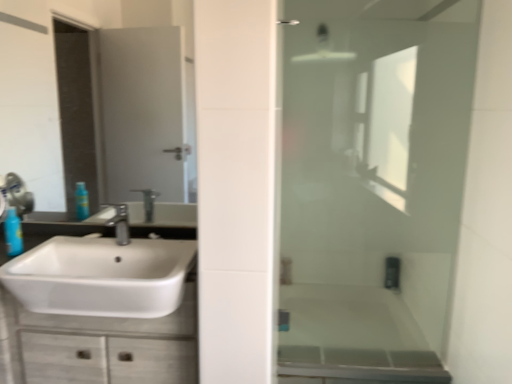
The height and width of the screenshot is (384, 512). Find the location of `satin nickel faucet at center`. satin nickel faucet at center is located at coordinates (120, 223).

The image size is (512, 384). What do you see at coordinates (101, 274) in the screenshot?
I see `white glossy sink at left` at bounding box center [101, 274].

In order to click on clear glass mirror at upper left in this screenshot , I will do `click(56, 80)`.

What is the approximate width of transparent glass shower door at right?

It is 2.01 inches.

Describe the element at coordinates (373, 185) in the screenshot. The height and width of the screenshot is (384, 512). I see `transparent glass shower door at right` at that location.

You are a GUI agent. You are given a task and a screenshot of the screen. Output one action in this format:
    pyautogui.click(x=<x>, y=<y>)
    Task: Click on the satin nickel faucet at center
    This screenshot has width=512, height=384.
    Given the screenshot: What is the action you would take?
    pyautogui.click(x=120, y=223)

Based on their sizes in the image, would you say white glossy sink at left is bigger or smaller than clear glass mirror at upper left?

In the image, white glossy sink at left appears to be larger than clear glass mirror at upper left.

Considering the positions of objects white glossy sink at left and clear glass mirror at upper left in the image provided, who is more to the left, white glossy sink at left or clear glass mirror at upper left?

Positioned to the left is clear glass mirror at upper left.

Between point (40, 288) and point (3, 38), which one is positioned in front?

The point (40, 288) is closer.

From a real-world perspective, relative to white glossy sink at left, is white glossy cabinet at lower left vertically above or below?

white glossy cabinet at lower left is below white glossy sink at left.

From the image's perspective, between white glossy cabinet at lower left and white glossy sink at left, which one is located above?

From the image's view, white glossy sink at left is above.

In terms of height, does white glossy cabinet at lower left look taller or shorter compared to white glossy sink at left?

In the image, white glossy cabinet at lower left appears to be taller than white glossy sink at left.

Are white glossy cabinet at lower left and white glossy sink at left making contact?

No, white glossy cabinet at lower left is not next to white glossy sink at left.

Is clear glass mirror at upper left wider or thinner than satin nickel faucet at center?

In the image, clear glass mirror at upper left appears to be more narrow than satin nickel faucet at center.

From the picture: Does clear glass mirror at upper left appear on the left side of satin nickel faucet at center?

Yes, clear glass mirror at upper left is to the left of satin nickel faucet at center.

Is clear glass mirror at upper left placed right next to satin nickel faucet at center?

No, clear glass mirror at upper left is not beside satin nickel faucet at center.

Is clear glass mirror at upper left positioned with its back to satin nickel faucet at center?

clear glass mirror at upper left is not turned away from satin nickel faucet at center.

Does translucent plastic bottle at left contain transparent glass shower door at right?

No, transparent glass shower door at right is not a part of translucent plastic bottle at left.

From the image's perspective, does translucent plastic bottle at left appear lower than transparent glass shower door at right?

Yes, from the image's perspective, translucent plastic bottle at left is below transparent glass shower door at right.

Consider the image. Can you confirm if translucent plastic bottle at left is positioned to the left of transparent glass shower door at right?

Indeed, translucent plastic bottle at left is positioned on the left side of transparent glass shower door at right.

In order to click on mirror in front of the transparent glass shower door at right in this screenshot , I will do `click(56, 80)`.

Does clear glass mirror at upper left have a smaller size compared to transparent glass shower door at right?

Yes, clear glass mirror at upper left is smaller than transparent glass shower door at right.

Looking at this image, does clear glass mirror at upper left come in front of transparent glass shower door at right?

Yes, clear glass mirror at upper left is closer to the camera.

Is clear glass mirror at upper left outside of transparent glass shower door at right?

Absolutely, clear glass mirror at upper left is external to transparent glass shower door at right.

Is satin nickel faucet at center positioned behind translucent plastic bottle at left?

No, satin nickel faucet at center is in front of translucent plastic bottle at left.

Would you say satin nickel faucet at center is a long distance from translucent plastic bottle at left?

Actually, satin nickel faucet at center and translucent plastic bottle at left are a little close together.

Considering the sizes of objects satin nickel faucet at center and translucent plastic bottle at left in the image provided, who is shorter, satin nickel faucet at center or translucent plastic bottle at left?

satin nickel faucet at center.

Is satin nickel faucet at center oriented towards translucent plastic bottle at left?

No, satin nickel faucet at center is not facing towards translucent plastic bottle at left.

Is translucent plastic bottle at left aimed at white glossy sink at left?

No.

In the scene shown: Considering the sizes of objects translucent plastic bottle at left and white glossy sink at left in the image provided, who is taller, translucent plastic bottle at left or white glossy sink at left?

white glossy sink at left is taller.

Between translucent plastic bottle at left and white glossy sink at left, which one has smaller size?

translucent plastic bottle at left.

Considering the sizes of objects translucent plastic bottle at left and white glossy sink at left in the image provided, who is thinner, translucent plastic bottle at left or white glossy sink at left?

translucent plastic bottle at left.

Image resolution: width=512 pixels, height=384 pixels. I want to click on mirror on the left of white glossy sink at left, so click(56, 80).

The image size is (512, 384). I want to click on bathroom cabinet that appears behind the white glossy sink at left, so (108, 346).

Consider the image. Which object lies nearer to the anchor point transparent glass shower door at right, translucent plastic bottle at left or white glossy sink at left?

white glossy sink at left.

When comparing their distances from translucent plastic bottle at left, does white glossy cabinet at lower left or satin nickel faucet at center seem closer?

satin nickel faucet at center.

When comparing their distances from white glossy sink at left, does white glossy cabinet at lower left or transparent glass shower door at right seem closer?

white glossy cabinet at lower left lies closer to white glossy sink at left than the other object.

Looking at the image, which one is located closer to clear glass mirror at upper left, white glossy cabinet at lower left or transparent glass shower door at right?

white glossy cabinet at lower left is positioned closer to the anchor clear glass mirror at upper left.

Which object lies nearer to the anchor point white glossy cabinet at lower left, clear glass mirror at upper left or transparent glass shower door at right?

transparent glass shower door at right.

Looking at the image, which one is located further to satin nickel faucet at center, translucent plastic bottle at left or clear glass mirror at upper left?

clear glass mirror at upper left.

Estimate the real-world distances between objects in this image. Which object is further from translucent plastic bottle at left, clear glass mirror at upper left or white glossy sink at left?

clear glass mirror at upper left is further to translucent plastic bottle at left.

Estimate the real-world distances between objects in this image. Which object is further from transparent glass shower door at right, white glossy cabinet at lower left or white glossy sink at left?

The object further to transparent glass shower door at right is white glossy cabinet at lower left.

The image size is (512, 384). I want to click on tap between clear glass mirror at upper left and white glossy sink at left in the vertical direction, so click(x=120, y=223).

You are a GUI agent. You are given a task and a screenshot of the screen. Output one action in this format:
    pyautogui.click(x=<x>, y=<y>)
    Task: Click on the sink between translucent plastic bottle at left and satin nickel faucet at center
    Image resolution: width=512 pixels, height=384 pixels.
    Given the screenshot: What is the action you would take?
    pyautogui.click(x=101, y=274)

Where is `sink between translucent plastic bottle at left and transparent glass shower door at right from left to right`? sink between translucent plastic bottle at left and transparent glass shower door at right from left to right is located at coordinates (101, 274).

Locate an element on the screen. The image size is (512, 384). mirror between white glossy cabinet at lower left and transparent glass shower door at right from left to right is located at coordinates (56, 80).